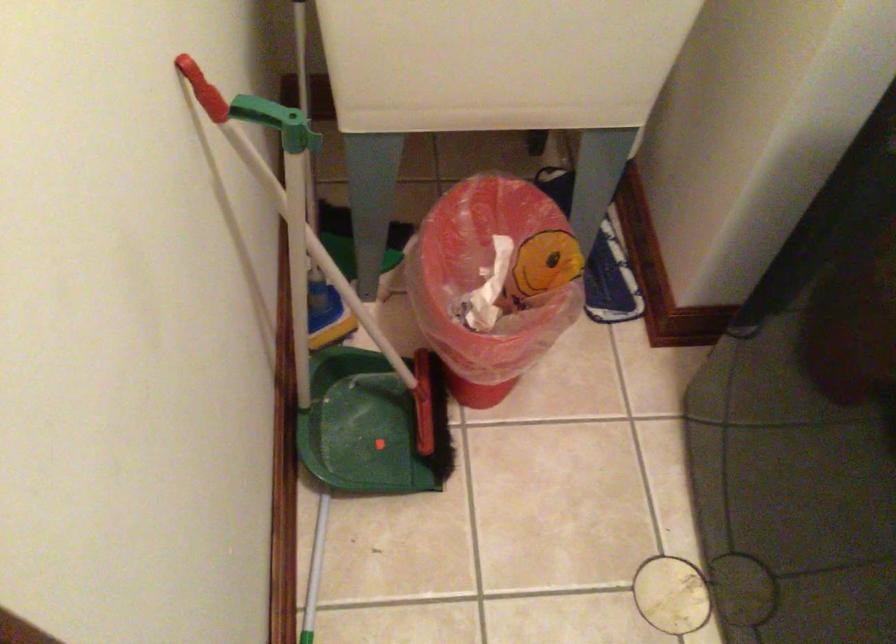
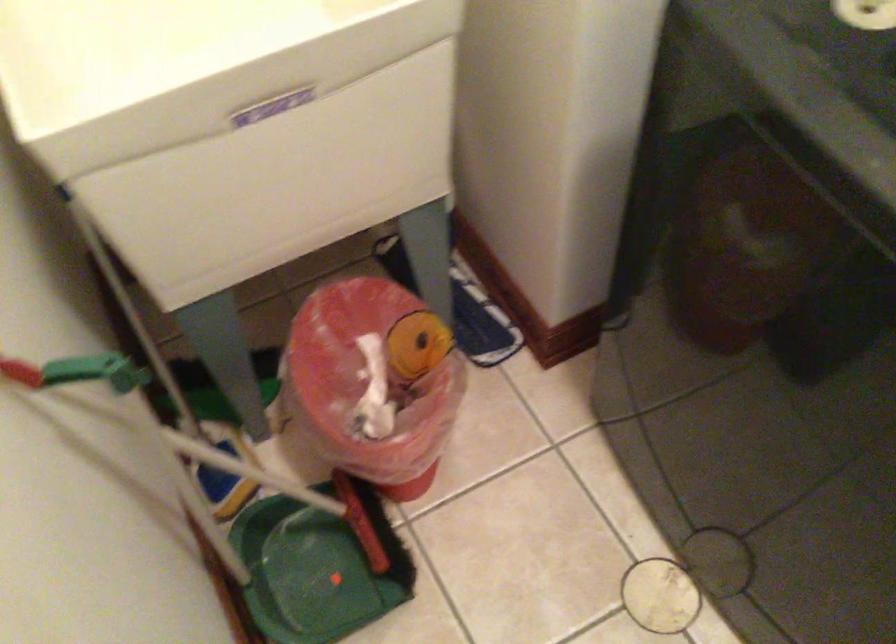
Question: The first image is from the beginning of the video and the second image is from the end. How did the camera likely rotate when shooting the video?

Choices:
 (A) Left
 (B) Right
 (C) Up
 (D) Down

Answer: (B)